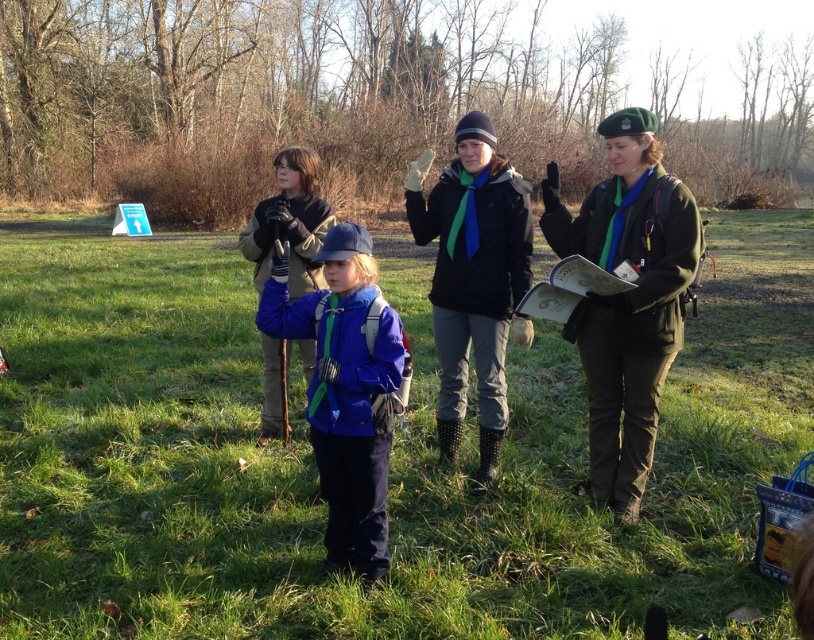
Question: Which object is the closest to the green fabric beret at right?

Choices:
 (A) matte blue jacket at center
 (B) green grass at center

Answer: (A)

Question: Is green grass at center to the left of green fabric beret at right from the viewer's perspective?

Choices:
 (A) no
 (B) yes

Answer: (B)

Question: Is green grass at center to the left of green fabric beret at right from the viewer's perspective?

Choices:
 (A) no
 (B) yes

Answer: (B)

Question: Does green grass at center come behind matte blue jacket at center?

Choices:
 (A) yes
 (B) no

Answer: (B)

Question: Which is nearer to the matte blue jacket at center?

Choices:
 (A) green grass at center
 (B) green fabric beret at right

Answer: (B)

Question: Which point appears farthest from the camera in this image?

Choices:
 (A) (659, 212)
 (B) (360, 422)
 (C) (664, 435)

Answer: (C)